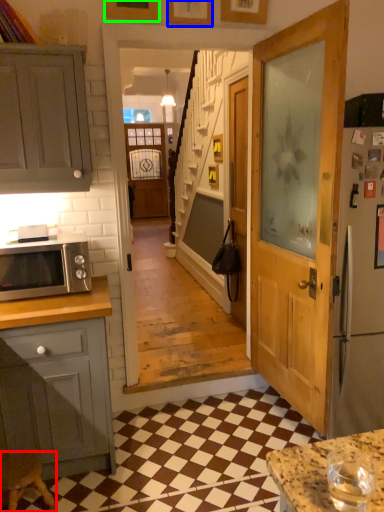
Question: Considering the real-world distances, which object is farthest from stool (highlighted by a red box)? picture frame (highlighted by a blue box) or picture frame (highlighted by a green box)?

Choices:
 (A) picture frame
 (B) picture frame

Answer: (A)